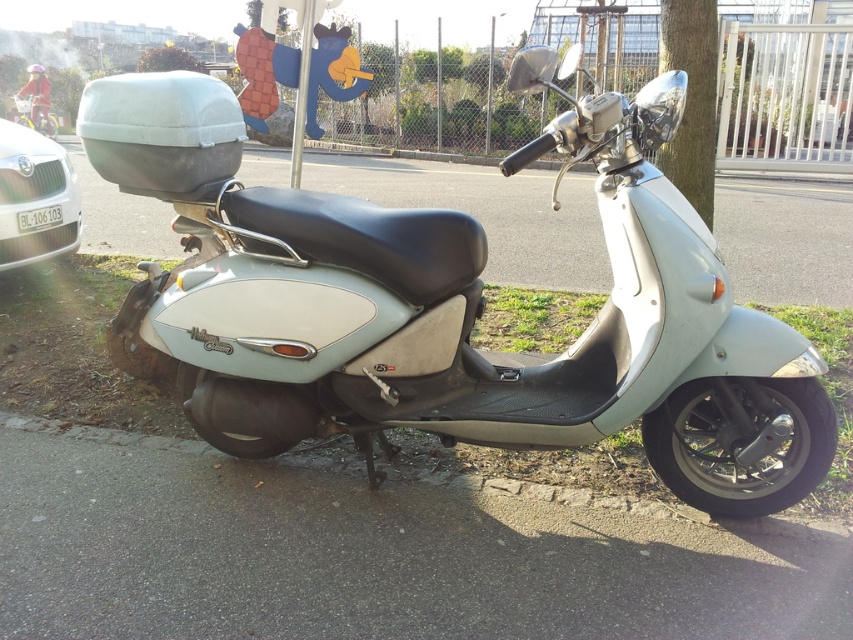
Between matte white scooter at upper left and white plastic license plate at center, which one appears on the left side from the viewer's perspective?

Positioned to the left is matte white scooter at upper left.

Image resolution: width=853 pixels, height=640 pixels. Identify the location of matte white scooter at upper left. (35, 115).

Which is in front, point (511, 416) or point (45, 115)?

Point (511, 416) is more forward.

Is point (630, 276) less distant than point (39, 120)?

That is True.

Is point (463, 432) less distant than point (15, 100)?

Yes, it is.

Identify the location of satin silver scooter at center. (450, 308).

Where is `matte white car at left`? matte white car at left is located at coordinates (35, 198).

Between point (45, 141) and point (33, 216), which one is positioned behind?

Point (45, 141)

Is point (12, 196) closer to camera compared to point (56, 225)?

Yes.

Find the location of a particular element. This screenshot has height=640, width=853. matte white car at left is located at coordinates (35, 198).